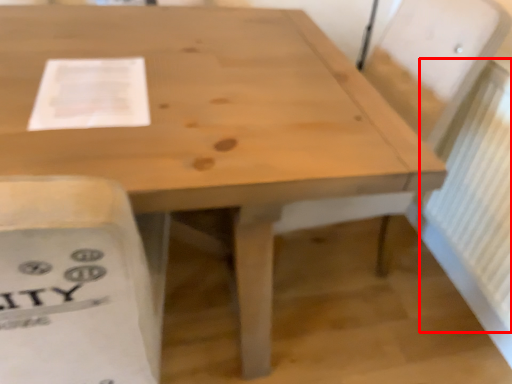
Question: From the image's perspective, where is radiator (annotated by the red box) located relative to paper?

Choices:
 (A) below
 (B) above

Answer: (A)